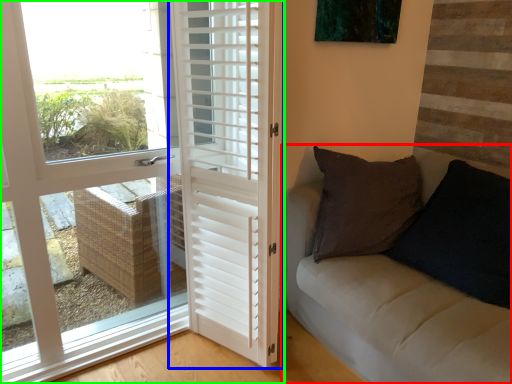
Question: Estimate the real-world distances between objects in this image. Which object is closer to studio couch (highlighted by a red box), door (highlighted by a blue box) or door (highlighted by a green box)?

Choices:
 (A) door
 (B) door

Answer: (A)